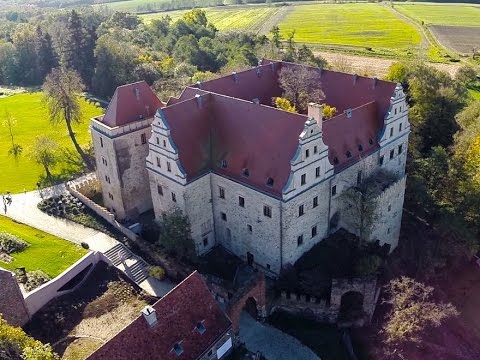
At what (x,y) coordinates should I click in order to perform the action: click on window. Please return your answer as a coordinate pair (x, y). Image resolution: width=480 pixels, height=360 pixels. Looking at the image, I should click on (266, 210).